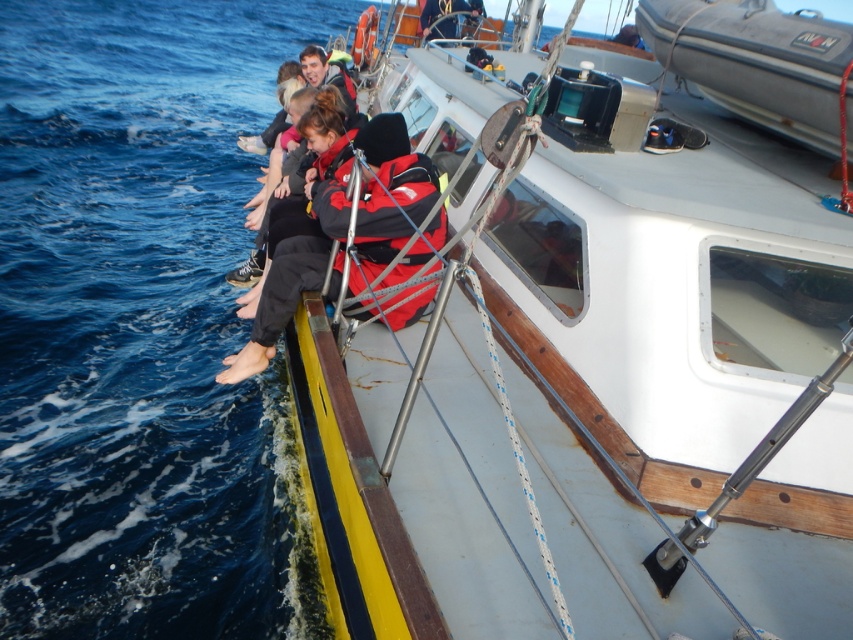
Question: Which of the following is the closest to the observer?

Choices:
 (A) gray rubber dinghy at upper right
 (B) red jacket at left

Answer: (A)

Question: Among these points, which one is farthest from the camera?

Choices:
 (A) (595, 426)
 (B) (811, 90)
 (C) (94, 138)

Answer: (C)

Question: Can you confirm if white plastic boat at center is smaller than red jacket at left?

Choices:
 (A) yes
 (B) no

Answer: (B)

Question: Considering the real-world distances, which object is closest to the red matte life jacket at upper center?

Choices:
 (A) red jacket at left
 (B) blue water at lower left

Answer: (B)

Question: Can you confirm if white plastic boat at center is thinner than blue water at lower left?

Choices:
 (A) yes
 (B) no

Answer: (A)

Question: Does white plastic boat at center lie behind blue water at lower left?

Choices:
 (A) yes
 (B) no

Answer: (B)